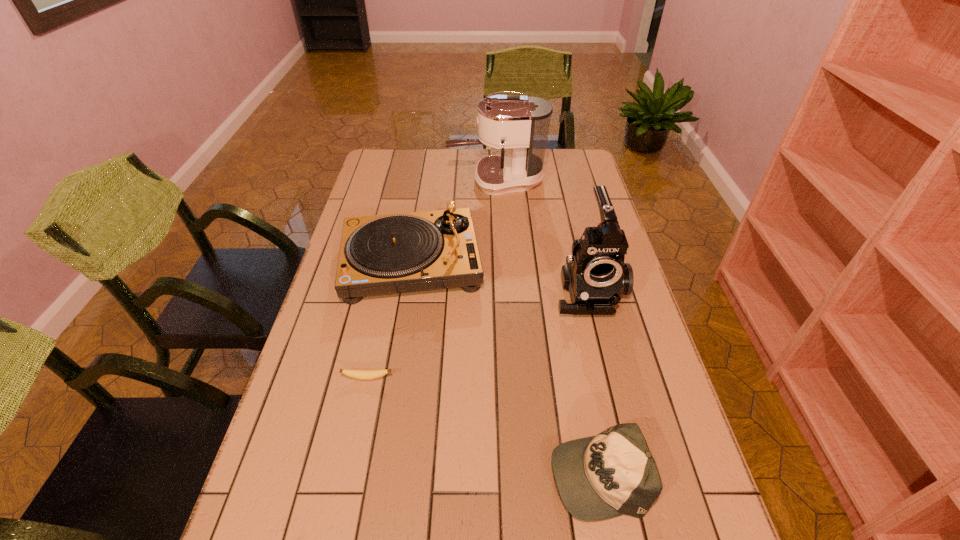
Identify the location of the fourth closest object relative to the farthest object. The image size is (960, 540). (613, 473).

Identify which object is the second nearest to the banana. Please provide its 2D coordinates. Your answer should be formatted as a tuple, i.e. [(x, y)], where the tuple contains the x and y coordinates of a point satisfying the conditions above.

[(613, 473)]